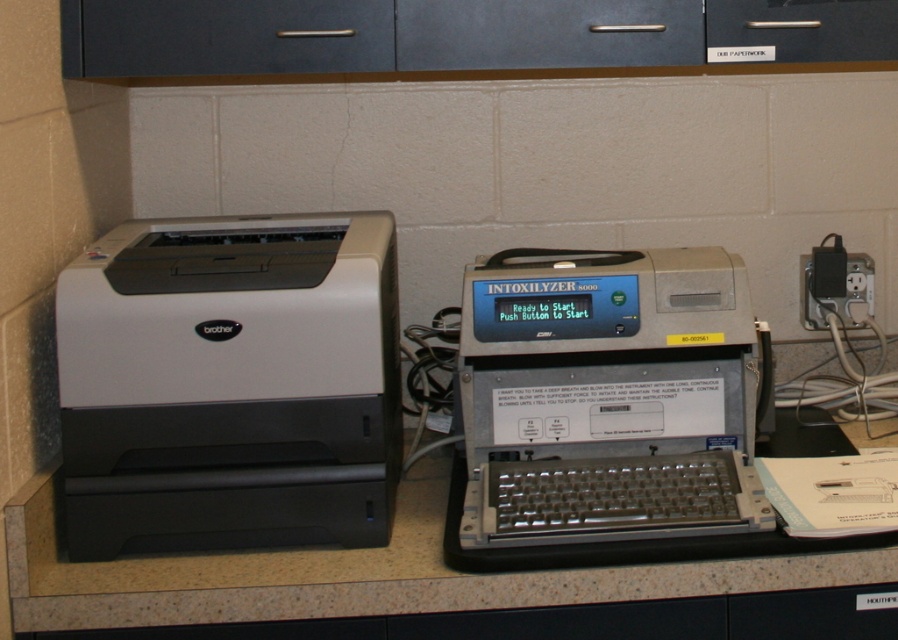
You are a technician who needs to calibrate the camera and the dark gray matte drawer at upper center. The calibration requires both devices to be exactly 5 feet apart. According to the scene description, are they currently positioned at the correct distance?

The dark gray matte drawer at upper center and camera are 4.62 feet apart, which is less than the required 5 feet. Therefore, they are not positioned at the correct distance for calibration.

You are a technician standing 1.5 meters away from the workspace. You need to reach the matte black printer at left to perform maintenance. Can you comfortably reach it without moving closer?

The matte black printer at left is 1.27 meters away from the viewer. Since you are standing 1.5 meters away, you are 0.23 meters too far to comfortably reach it without moving closer.

You are a technician who needs to reach the granite countertop at center to perform maintenance. You are currently standing 1.20 meters away from it. Can you comfortably reach the countertop without moving closer? Please explain your reasoning.

The granite countertop at center is 1.20 meters away from the viewer. Since the average comfortable reaching distance for most adults is typically around 0.7 to 1 meter, reaching 1.20 meters may be slightly uncomfortable or require stretching. Therefore, it might be advisable to move closer for a more comfortable and safe maintenance task.